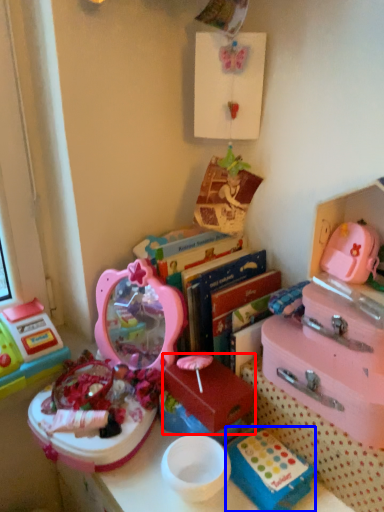
Question: Which point is further to the camera, storage box (highlighted by a red box) or storage box (highlighted by a blue box)?

Choices:
 (A) storage box
 (B) storage box

Answer: (A)